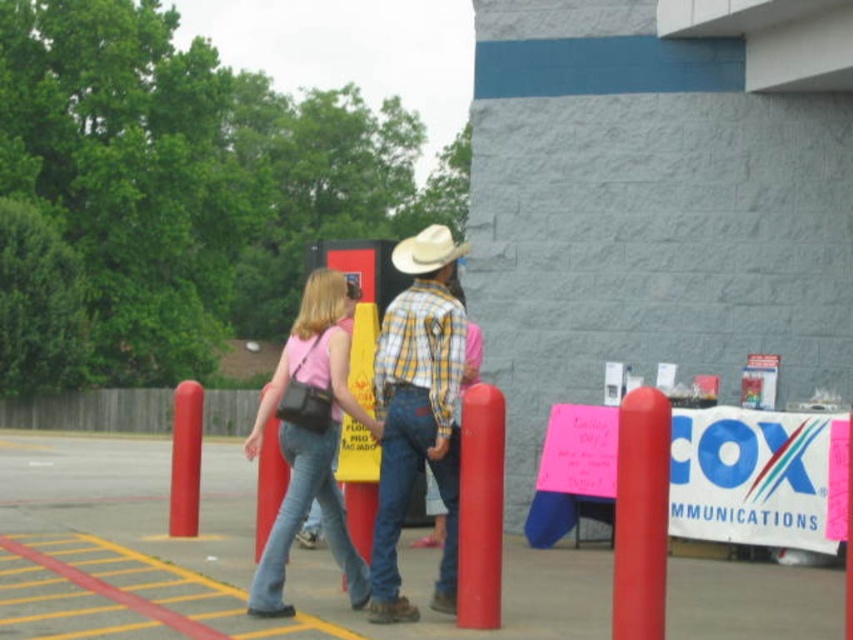
Question: Which point appears closest to the camera in this image?

Choices:
 (A) (477, 504)
 (B) (403, 508)
 (C) (196, 452)
 (D) (299, 310)

Answer: (A)

Question: Estimate the real-world distances between objects in this image. Which object is closer to the smooth glossy red post at center?

Choices:
 (A) rubber-like red post at center-left
 (B) pink fabric purse at center

Answer: (B)

Question: Estimate the real-world distances between objects in this image. Which object is farther from the pink fabric purse at center?

Choices:
 (A) rubber-like red post at center-left
 (B) smooth glossy red post at center
 (C) plaid shirt at center
 (D) smooth matte red post at center right

Answer: (A)

Question: Is plaid shirt at center above smooth glossy red post at center?

Choices:
 (A) yes
 (B) no

Answer: (A)

Question: Is the position of pink fabric purse at center more distant than that of smooth glossy red post at center?

Choices:
 (A) no
 (B) yes

Answer: (B)

Question: Is plaid shirt at center thinner than pink fabric purse at center?

Choices:
 (A) yes
 (B) no

Answer: (A)